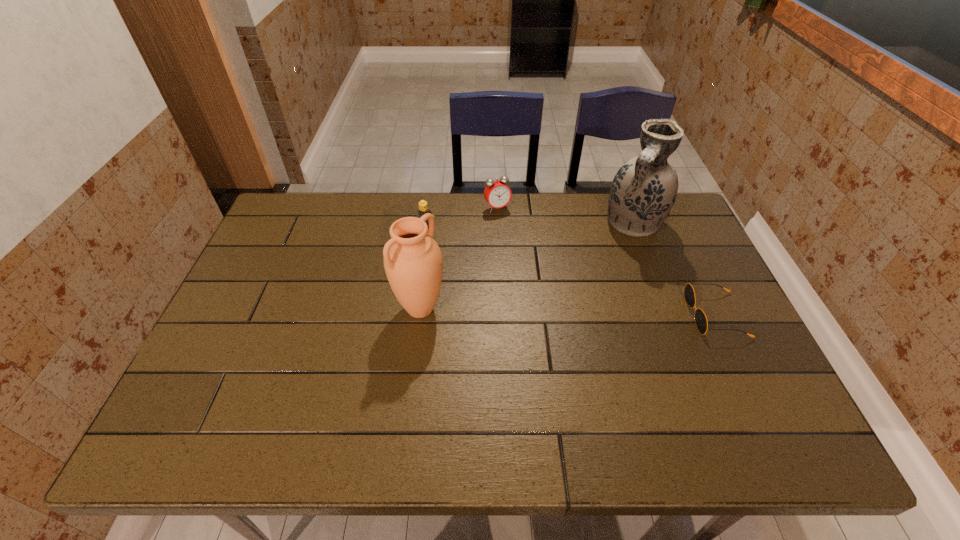
At what (x,y) coordinates should I click in order to perform the action: click on free spot on the desktop that is between the urn and the sunglasses and is positioned on the front-facing side of the alarm clock. Please return your answer as a coordinate pair (x, y). This screenshot has width=960, height=540. Looking at the image, I should click on (561, 312).

This screenshot has width=960, height=540. Find the location of `vacant space on the desktop that is between the fourth shortest object and the sunglasses and is positioned with the handle on the side of the tallest object`. vacant space on the desktop that is between the fourth shortest object and the sunglasses and is positioned with the handle on the side of the tallest object is located at coordinates (579, 312).

Locate an element on the screen. The width and height of the screenshot is (960, 540). free spot on the desktop that is between the urn and the sunglasses and is positioned in front of the Lego is located at coordinates (580, 312).